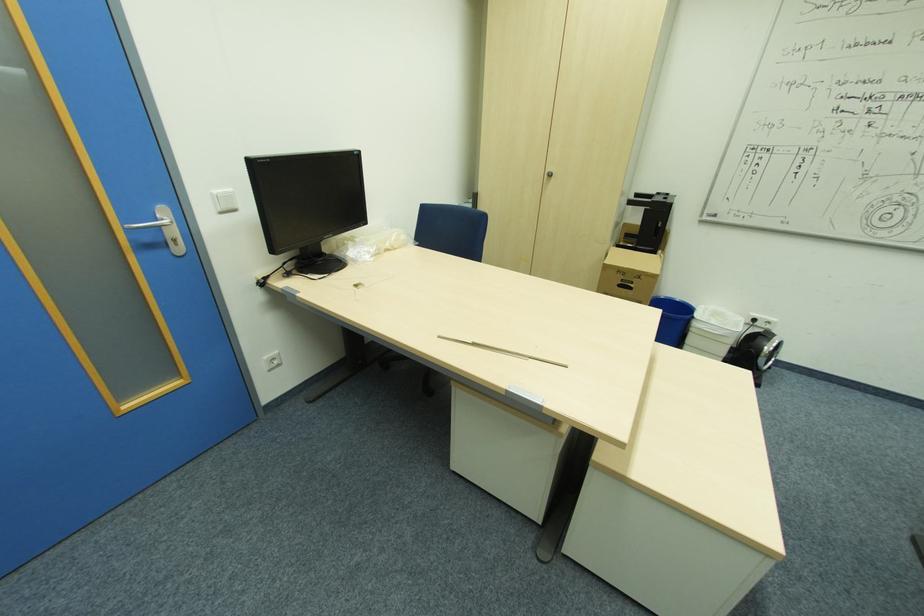
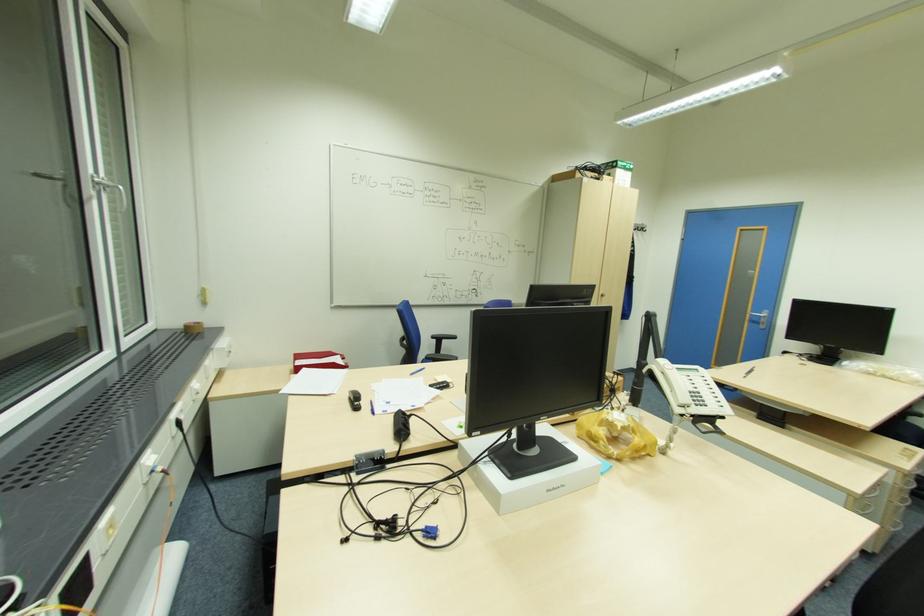
The point at (176, 240) is marked in the first image. Where is the corresponding point in the second image?

(766, 323)